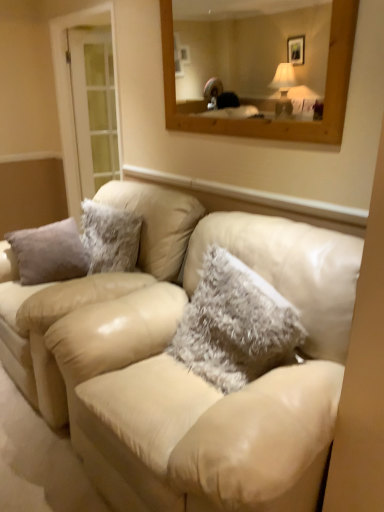
Question: Would you say clear glass door at left contains fuzzy white pillow at center?

Choices:
 (A) yes
 (B) no

Answer: (B)

Question: Can you confirm if clear glass door at left is taller than fuzzy white pillow at center?

Choices:
 (A) no
 (B) yes

Answer: (B)

Question: Can you confirm if clear glass door at left is wider than fuzzy white pillow at center?

Choices:
 (A) no
 (B) yes

Answer: (A)

Question: Can you confirm if clear glass door at left is smaller than fuzzy white pillow at center?

Choices:
 (A) no
 (B) yes

Answer: (A)

Question: From a real-world perspective, is clear glass door at left positioned under fuzzy white pillow at center based on gravity?

Choices:
 (A) no
 (B) yes

Answer: (A)

Question: Does clear glass door at left appear on the right side of fuzzy white pillow at center?

Choices:
 (A) no
 (B) yes

Answer: (A)

Question: Is fuzzy white pillow at center shorter than beige leather couch at center?

Choices:
 (A) yes
 (B) no

Answer: (A)

Question: Is fuzzy white pillow at center outside beige leather couch at center?

Choices:
 (A) yes
 (B) no

Answer: (A)

Question: Is fuzzy white pillow at center further to the viewer compared to beige leather couch at center?

Choices:
 (A) no
 (B) yes

Answer: (A)

Question: Can you confirm if fuzzy white pillow at center is thinner than beige leather couch at center?

Choices:
 (A) no
 (B) yes

Answer: (B)

Question: Can you confirm if fuzzy white pillow at center is taller than beige leather couch at center?

Choices:
 (A) yes
 (B) no

Answer: (B)

Question: Is fuzzy white pillow at center in contact with beige leather couch at center?

Choices:
 (A) no
 (B) yes

Answer: (A)

Question: Is beige leather couch at center facing away from fuzzy white pillow at center?

Choices:
 (A) yes
 (B) no

Answer: (A)